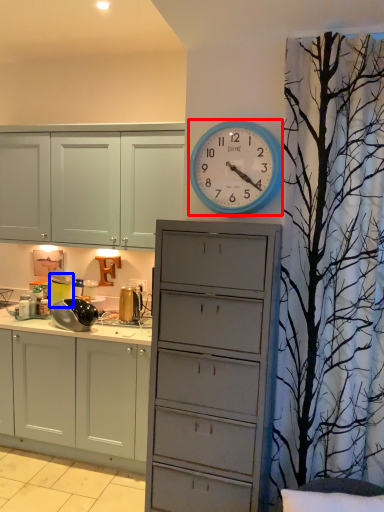
Question: Which of the following is the farthest to the observer, wall clock (highlighted by a red box) or appliance (highlighted by a blue box)?

Choices:
 (A) wall clock
 (B) appliance

Answer: (B)